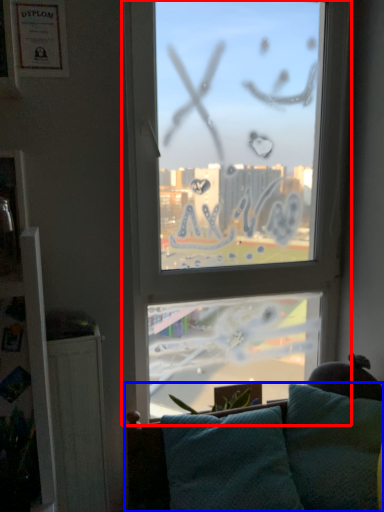
Question: Among these objects, which one is farthest to the camera, window (highlighted by a red box) or studio couch (highlighted by a blue box)?

Choices:
 (A) window
 (B) studio couch

Answer: (A)